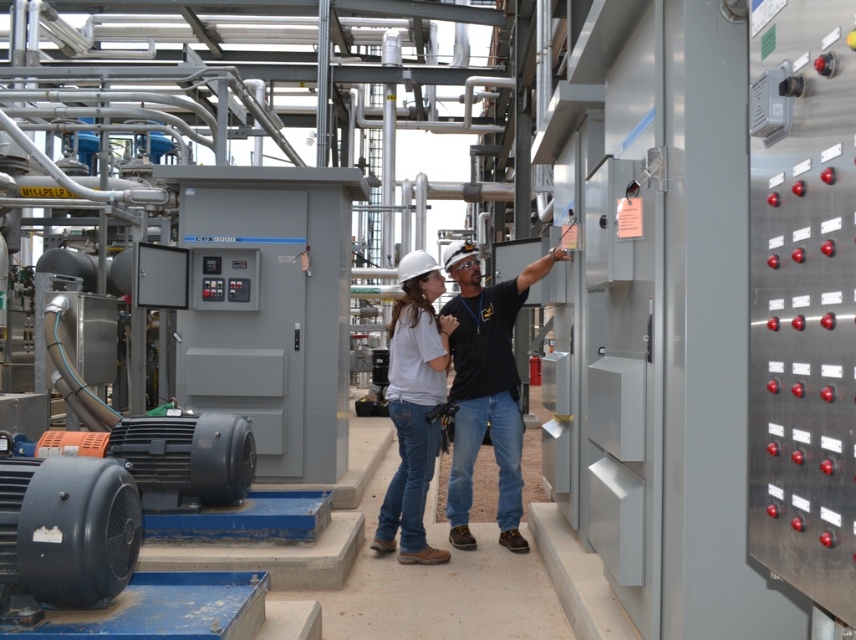
Which of these two, matte black shirt at center or white matte helmet at center, stands taller?

With more height is matte black shirt at center.

Measure the distance between point (480, 330) and camera.

They are 5.68 meters apart.

Is point (520, 445) farther from viewer compared to point (415, 496)?

Yes, point (520, 445) is behind point (415, 496).

Locate an element on the screen. matte black shirt at center is located at coordinates (486, 387).